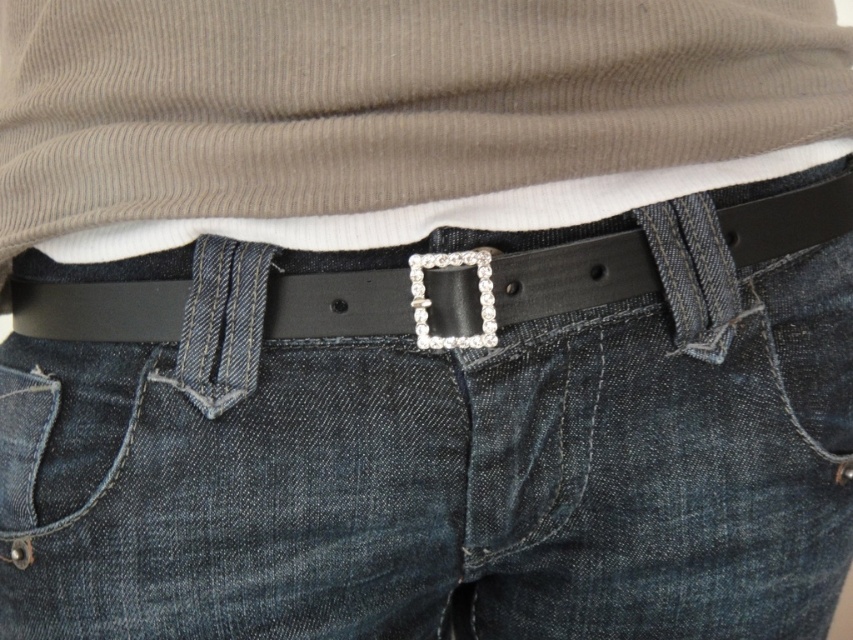
Question: Can you confirm if black leather belt at center is thinner than sparkly silver buckle at center?

Choices:
 (A) yes
 (B) no

Answer: (B)

Question: Which point appears closest to the camera in this image?

Choices:
 (A) (367, 90)
 (B) (415, 292)

Answer: (A)

Question: Is matte brown ribbed shirt at center thinner than sparkly silver buckle at center?

Choices:
 (A) yes
 (B) no

Answer: (B)

Question: Is matte brown ribbed shirt at center in front of black leather belt at center?

Choices:
 (A) no
 (B) yes

Answer: (B)

Question: Among these points, which one is farthest from the camera?

Choices:
 (A) (439, 266)
 (B) (433, 90)

Answer: (A)

Question: Which is farther from the matte brown ribbed shirt at center?

Choices:
 (A) sparkly silver buckle at center
 (B) black leather belt at center

Answer: (A)